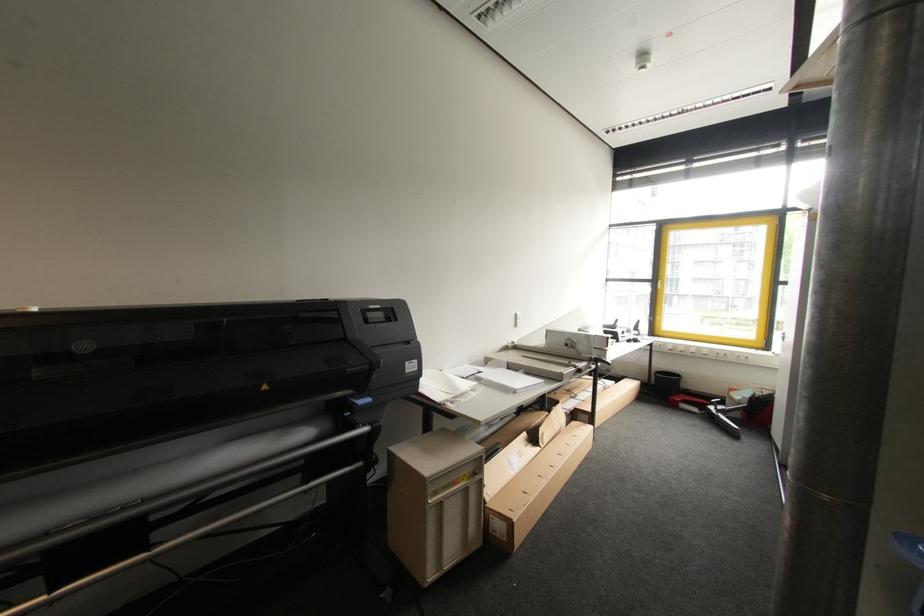
This screenshot has height=616, width=924. I want to click on plotter cover, so tap(173, 358).